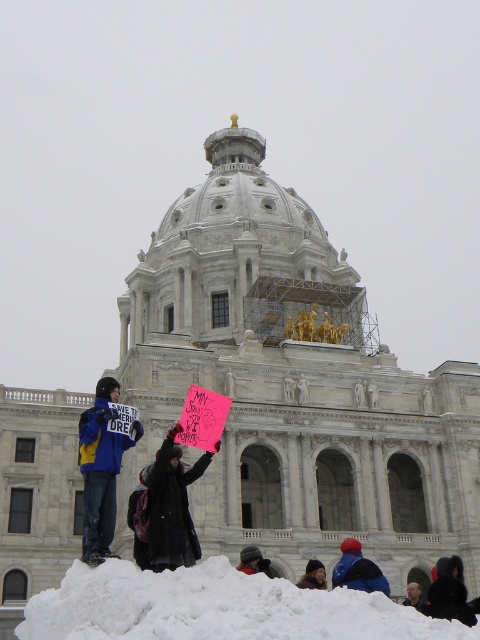
Is black fur coat at lower right shorter than blue fabric at lower right?

Yes, black fur coat at lower right is shorter than blue fabric at lower right.

Who is shorter, black fur coat at lower right or blue fabric at lower right?

black fur coat at lower right is shorter.

Image resolution: width=480 pixels, height=640 pixels. Describe the element at coordinates (448, 593) in the screenshot. I see `black fur coat at lower right` at that location.

Image resolution: width=480 pixels, height=640 pixels. In order to click on black fur coat at lower right in this screenshot , I will do `click(448, 593)`.

Is blue fabric at lower right positioned behind dark gray jacket at lower right?

No, it is in front of dark gray jacket at lower right.

Can you confirm if blue fabric at lower right is positioned to the left of dark gray jacket at lower right?

Correct, you'll find blue fabric at lower right to the left of dark gray jacket at lower right.

What are the coordinates of `blue fabric at lower right` in the screenshot? It's located at (358, 570).

This screenshot has width=480, height=640. What do you see at coordinates (358, 570) in the screenshot? I see `blue fabric at lower right` at bounding box center [358, 570].

How distant is blue fabric at lower right from dark blue jacket at lower center?

blue fabric at lower right and dark blue jacket at lower center are 12.47 feet apart.

Between point (356, 556) and point (242, 566), which one is positioned in front?

Point (242, 566) is in front.

Locate an element on the screen. blue fabric at lower right is located at coordinates (358, 570).